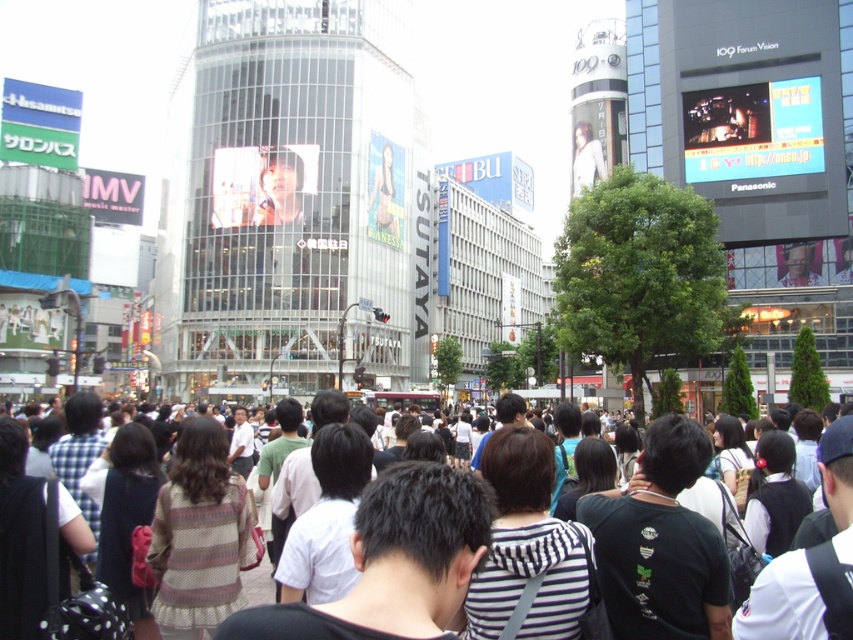
Question: Is smooth skin face at center positioned behind white cotton shirt at center?

Choices:
 (A) no
 (B) yes

Answer: (B)

Question: Which of the following is the closest to the observer?

Choices:
 (A) smooth skin face at center
 (B) white cotton shirt at center

Answer: (B)

Question: Which object is closer to the camera taking this photo?

Choices:
 (A) white cotton shirt at center
 (B) smooth skin face at center

Answer: (A)

Question: From the image, what is the correct spatial relationship of smooth skin face at center in relation to white cotton shirt at center?

Choices:
 (A) above
 (B) below

Answer: (A)

Question: Does smooth skin face at center appear over white cotton shirt at center?

Choices:
 (A) no
 (B) yes

Answer: (B)